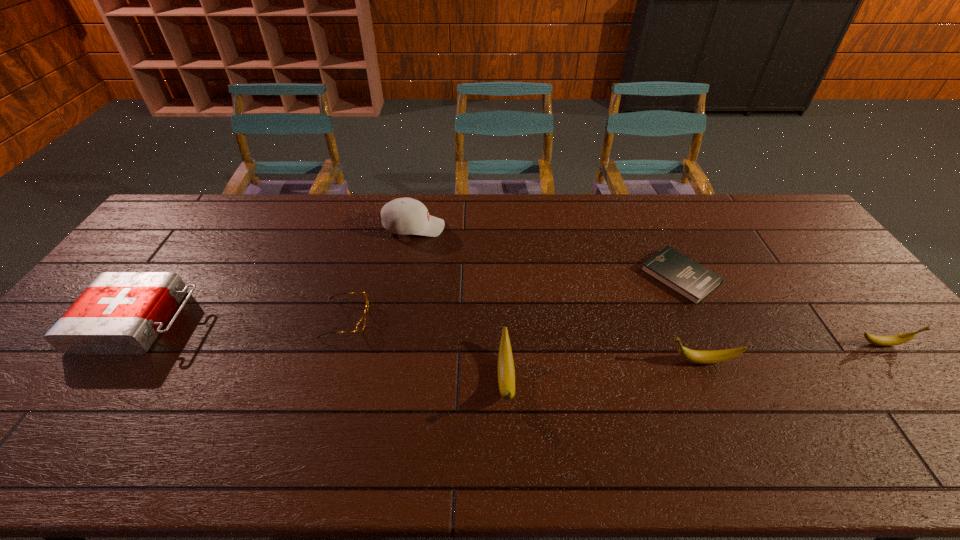
This screenshot has height=540, width=960. In order to click on the fourth object from left to right in this screenshot , I will do `click(506, 374)`.

Where is `the tallest banana`? the tallest banana is located at coordinates (506, 374).

In order to click on the second shortest banana in this screenshot , I will do pos(695,356).

Where is `the rightmost object`? the rightmost object is located at coordinates (893, 340).

Find the location of a particular element. This screenshot has width=960, height=540. the rightmost banana is located at coordinates (893, 340).

I want to click on book, so click(683, 275).

I want to click on the farthest object, so click(404, 216).

In order to click on the first-aid kit in this screenshot , I will do `click(119, 312)`.

You are a GUI agent. You are given a task and a screenshot of the screen. Output one action in this format:
    pyautogui.click(x=<x>, y=<y>)
    Task: Click on the second shortest object
    This screenshot has height=540, width=960.
    Given the screenshot: What is the action you would take?
    pyautogui.click(x=360, y=325)

Locate an element on the screen. The height and width of the screenshot is (540, 960). vacant area situated at the stem of the second banana from left to right is located at coordinates (558, 361).